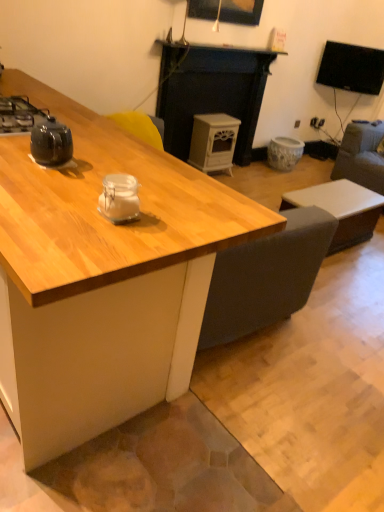
Question: From the image's perspective, is white matte coffee table at lower right under black glossy kettle at left?

Choices:
 (A) yes
 (B) no

Answer: (A)

Question: Can you confirm if white matte coffee table at lower right is taller than black glossy kettle at left?

Choices:
 (A) no
 (B) yes

Answer: (B)

Question: Is white matte coffee table at lower right far from black glossy kettle at left?

Choices:
 (A) yes
 (B) no

Answer: (A)

Question: From the image's perspective, is white matte coffee table at lower right over black glossy kettle at left?

Choices:
 (A) yes
 (B) no

Answer: (B)

Question: Is white matte coffee table at lower right positioned beyond the bounds of black glossy kettle at left?

Choices:
 (A) no
 (B) yes

Answer: (B)

Question: Is black glossy kettle at left wider or thinner than dark gray fabric swivel chair at right?

Choices:
 (A) wide
 (B) thin

Answer: (B)

Question: Is black glossy kettle at left bigger or smaller than dark gray fabric swivel chair at right?

Choices:
 (A) small
 (B) big

Answer: (A)

Question: Considering the positions of point (36, 110) and point (379, 139), is point (36, 110) closer or farther from the camera than point (379, 139)?

Choices:
 (A) farther
 (B) closer

Answer: (B)

Question: From a real-world perspective, is black glossy kettle at left physically located above or below dark gray fabric swivel chair at right?

Choices:
 (A) below
 (B) above

Answer: (B)

Question: Is black glossy kettle at left bigger or smaller than black glossy tv at upper right?

Choices:
 (A) big
 (B) small

Answer: (B)

Question: Do you think black glossy kettle at left is within black glossy tv at upper right, or outside of it?

Choices:
 (A) outside
 (B) inside

Answer: (A)

Question: Based on their positions, is black glossy kettle at left located to the left or right of black glossy tv at upper right?

Choices:
 (A) left
 (B) right

Answer: (A)

Question: Considering the positions of point (39, 115) and point (369, 83), is point (39, 115) closer or farther from the camera than point (369, 83)?

Choices:
 (A) closer
 (B) farther

Answer: (A)

Question: Looking at the image, does black glossy tv at upper right seem bigger or smaller compared to yellow fabric armchair at center?

Choices:
 (A) big
 (B) small

Answer: (A)

Question: Is point (357, 79) closer or farther from the camera than point (145, 124)?

Choices:
 (A) closer
 (B) farther

Answer: (B)